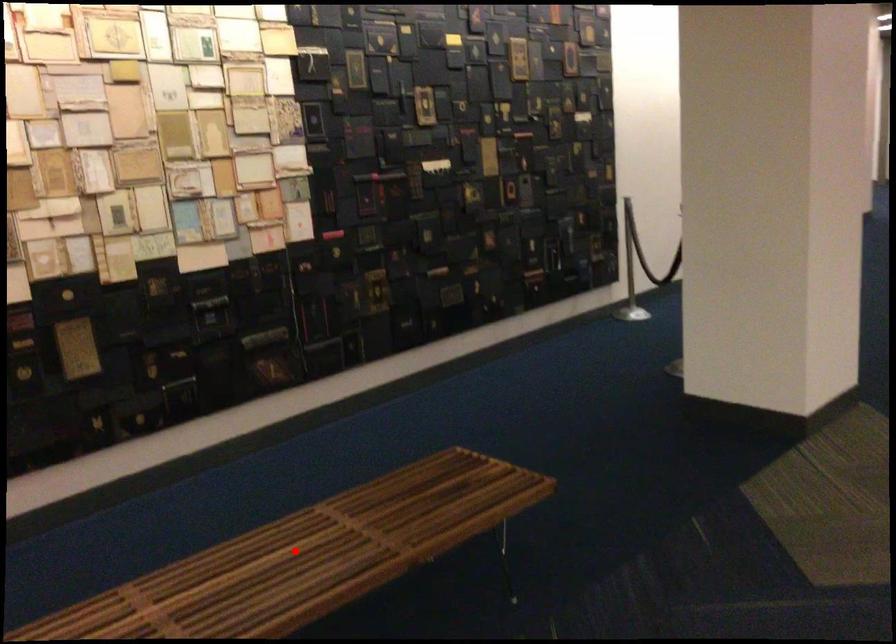
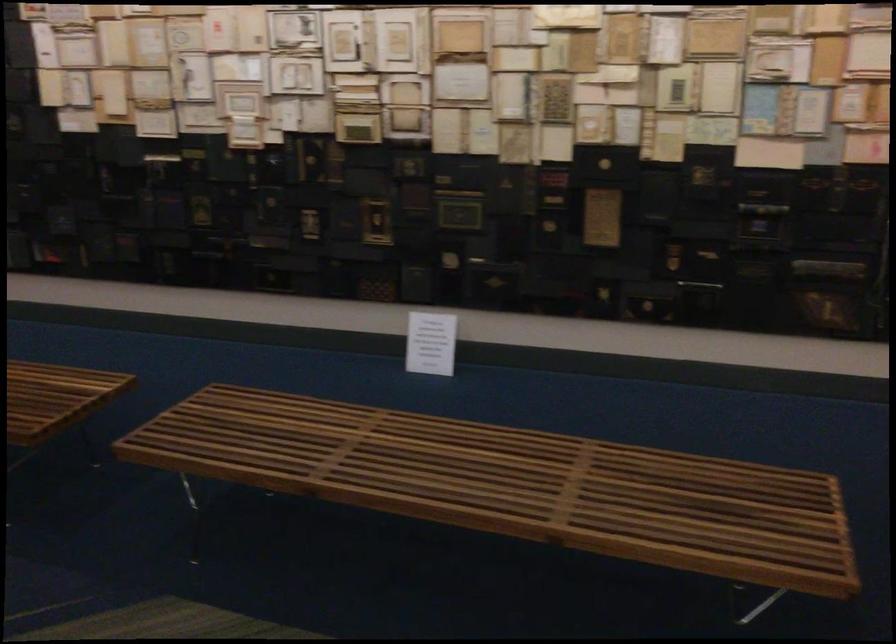
Question: I am providing you with two images of the same scene from different viewpoints. Image1 has a red point marked. In image2, the corresponding 3D location appears at what relative position? Reply with the corresponding letter.

Choices:
 (A) Closer
 (B) Farther

Answer: (A)